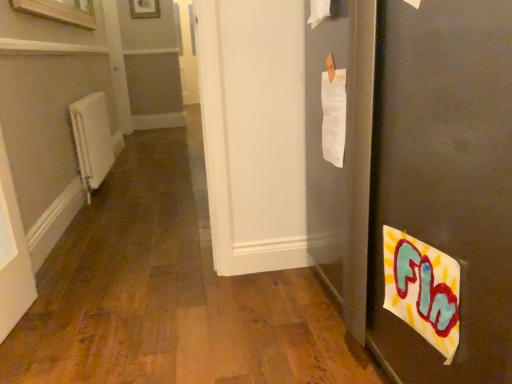
Where is `free spot below white matte radiator at left (from a real-world perspective)`? free spot below white matte radiator at left (from a real-world perspective) is located at coordinates (102, 190).